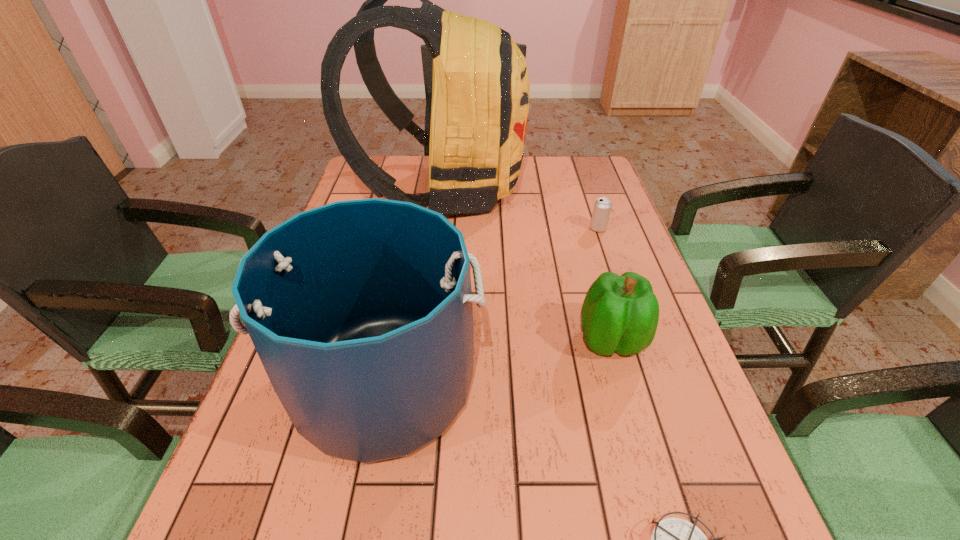
Find the location of a particular element. This screenshot has height=540, width=960. bucket that is at the left edge is located at coordinates (361, 313).

Identify the location of bell pepper present at the right edge. (620, 314).

Find the location of a particular element. The image size is (960, 540). beer can located at the right edge is located at coordinates (602, 207).

At what (x,y) coordinates should I click in order to perform the action: click on object at the far left corner. Please return your answer as a coordinate pair (x, y). The width and height of the screenshot is (960, 540). Looking at the image, I should click on (480, 94).

In order to click on vacant region at the far edge of the desktop in this screenshot , I will do `click(533, 162)`.

Identify the location of vacant space at the left edge. (372, 193).

The image size is (960, 540). Find the location of `vacant space at the right edge of the desktop`. vacant space at the right edge of the desktop is located at coordinates click(588, 238).

This screenshot has width=960, height=540. Identify the location of free space at the far left corner. (362, 181).

Identify the location of vacant space at the far right corner. The width and height of the screenshot is (960, 540). (609, 191).

The height and width of the screenshot is (540, 960). What are the coordinates of `free spot between the fourth shortest object and the third tallest object` in the screenshot? It's located at (497, 362).